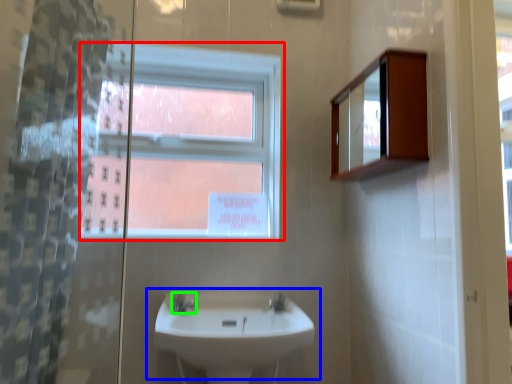
Question: Based on their relative distances, which object is nearer to window (highlighted by a red box)? Choose from sink (highlighted by a blue box) and tap (highlighted by a green box).

Choices:
 (A) sink
 (B) tap

Answer: (A)